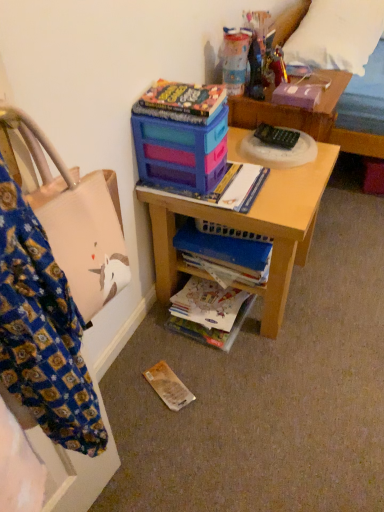
Where is `empty space that is ontop of matte paper book at lower center, which is the 2th book from top to bottom`? This screenshot has height=512, width=384. empty space that is ontop of matte paper book at lower center, which is the 2th book from top to bottom is located at coordinates (201, 298).